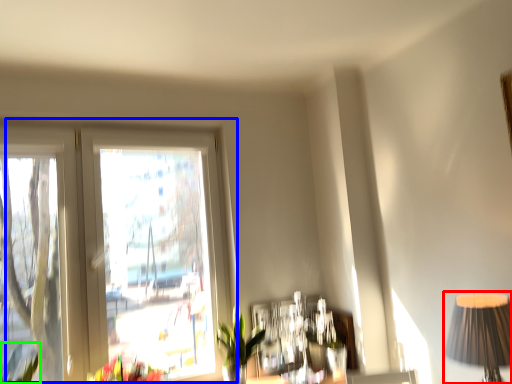
Question: Which is farther away from table lamp (highlighted by a red box)? window (highlighted by a blue box) or plant (highlighted by a green box)?

Choices:
 (A) window
 (B) plant

Answer: (B)